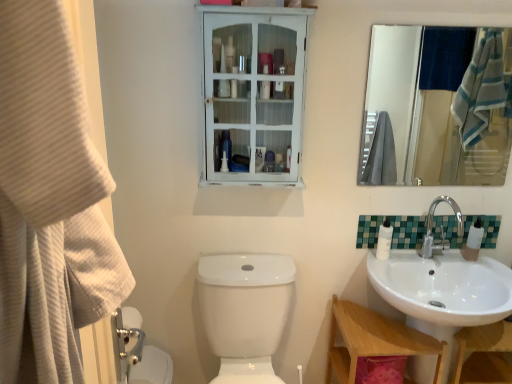
At what (x,y) coordinates should I click in order to perform the action: click on blank area beneath white distressed wood medicine cabinet at upper center (from a real-world perspective). Please return your answer as a coordinate pair (x, y). The height and width of the screenshot is (384, 512). Looking at the image, I should click on (246, 258).